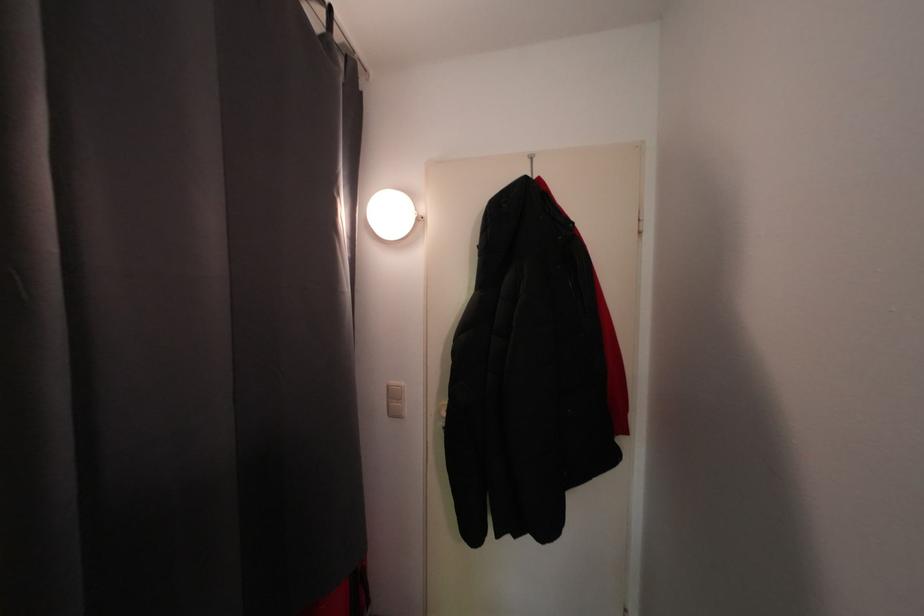
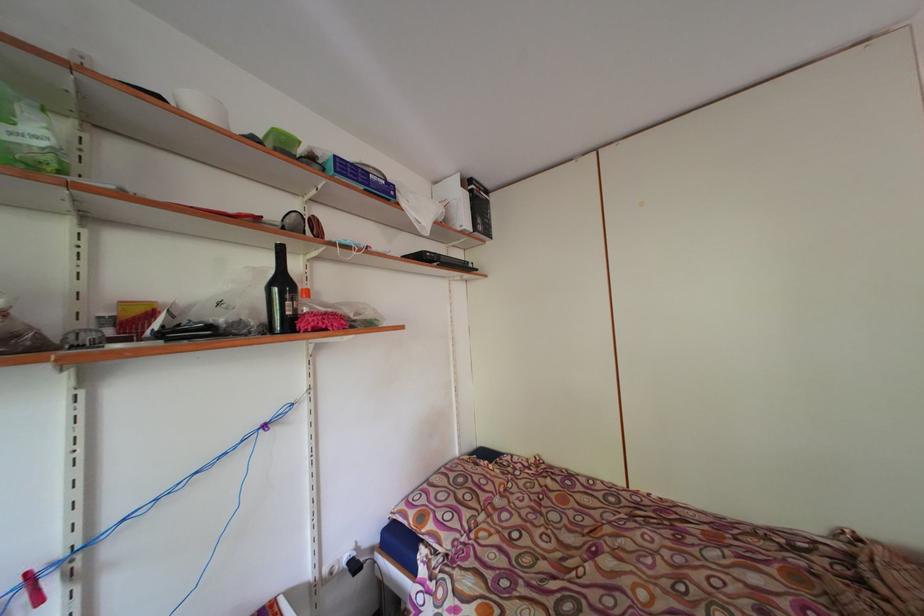
Based on the photo, what movement of the cameraman would produce the second image?

The cameraman walked toward left, backward.